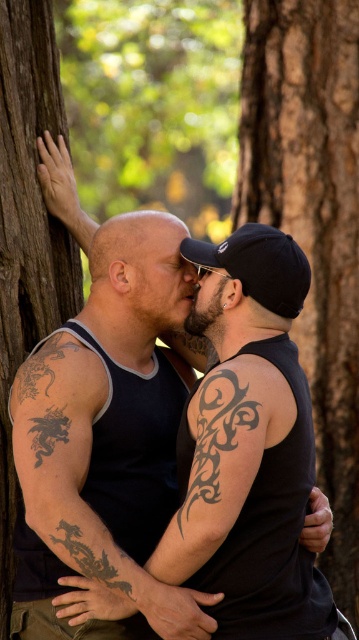
Question: Among these points, which one is nearest to the camera?

Choices:
 (A) (117, 227)
 (B) (20, 454)
 (C) (80, 451)
 (D) (338, 125)

Answer: (B)

Question: Is tattooed skin at center wider than brown rough tree trunk at left?

Choices:
 (A) yes
 (B) no

Answer: (A)

Question: Based on their relative distances, which object is nearer to the brown rough bark at center?

Choices:
 (A) bald head at center
 (B) tattooed skin at center
 (C) brown rough tree trunk at left

Answer: (C)

Question: From the image, what is the correct spatial relationship of brown rough bark at center in relation to black tribal tattoo at upper right?

Choices:
 (A) above
 (B) below

Answer: (A)

Question: Among these objects, which one is farthest from the camera?

Choices:
 (A) bald head at center
 (B) black tribal tattoo at upper right
 (C) brown rough tree trunk at left

Answer: (A)

Question: Is brown rough bark at center behind bald head at center?

Choices:
 (A) no
 (B) yes

Answer: (B)